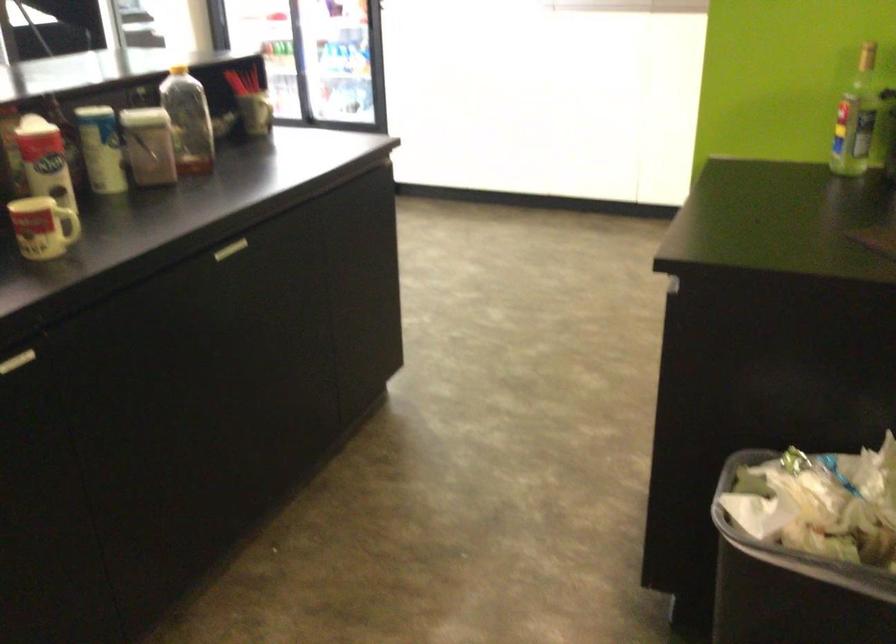
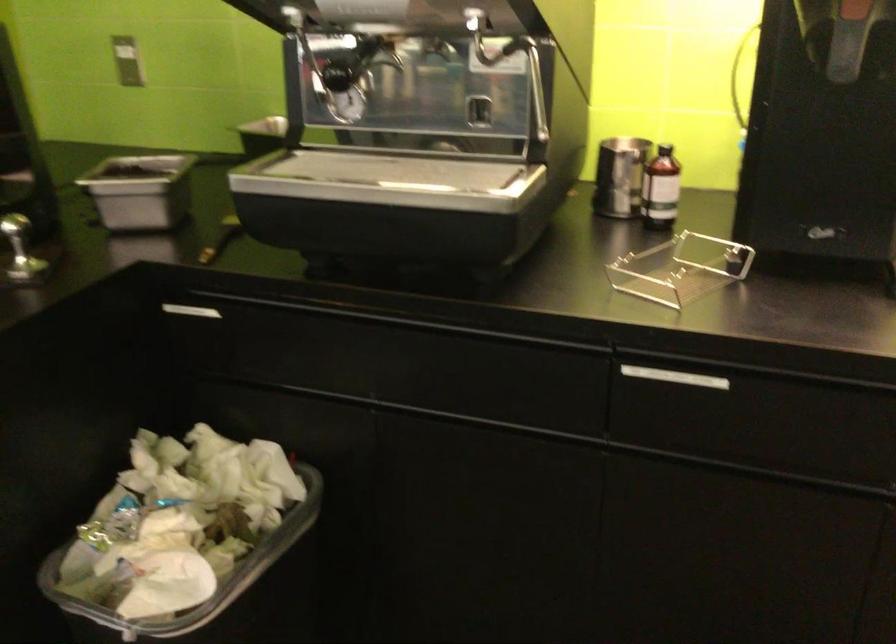
Locate, in the second image, the point that corresponds to point (778, 545) in the first image.

(218, 592)